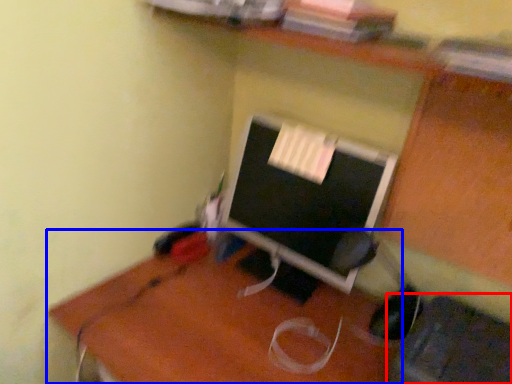
Question: Which point is closer to the camera, computer chair (highlighted by a red box) or desk (highlighted by a blue box)?

Choices:
 (A) computer chair
 (B) desk

Answer: (A)